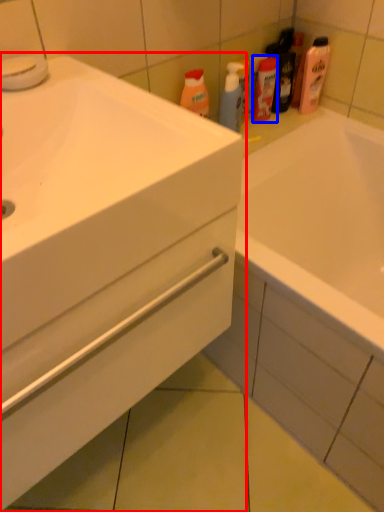
Question: Which object is closer to the camera taking this photo, bathroom cabinet (highlighted by a red box) or mouthwash (highlighted by a blue box)?

Choices:
 (A) bathroom cabinet
 (B) mouthwash

Answer: (A)